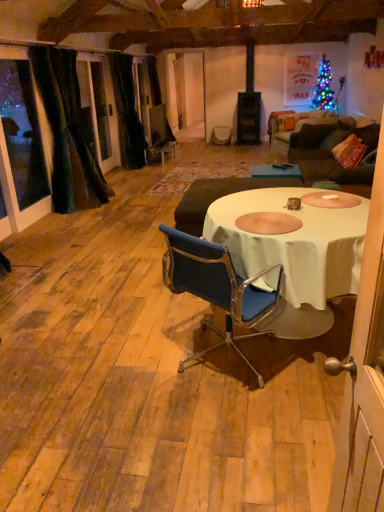
Question: Looking at their shapes, would you say blue fabric chair at center is wider or thinner than velvet dark green curtain at left, the 1th curtain from the front?

Choices:
 (A) thin
 (B) wide

Answer: (B)

Question: Choose the correct answer: Is blue fabric chair at center inside velvet dark green curtain at left, the 1th curtain from the front, or outside it?

Choices:
 (A) inside
 (B) outside

Answer: (B)

Question: Which is nearer to the white cloth table at center?

Choices:
 (A) black velvet curtain at left, which is counted as the first curtain, starting from the back
 (B) velvet dark green curtain at left, the 1th curtain from the front
 (C) velvet dark brown armchair at center
 (D) dark brown fabric couch at right
 (E) blue fabric chair at center

Answer: (E)

Question: Which is farther from the black velvet curtain at left, which is counted as the first curtain, starting from the back?

Choices:
 (A) velvet dark brown armchair at center
 (B) blue fabric chair at center
 (C) velvet dark green curtain at left, the 1th curtain from the front
 (D) transparent glass door at left
 (E) white cloth table at center

Answer: (B)